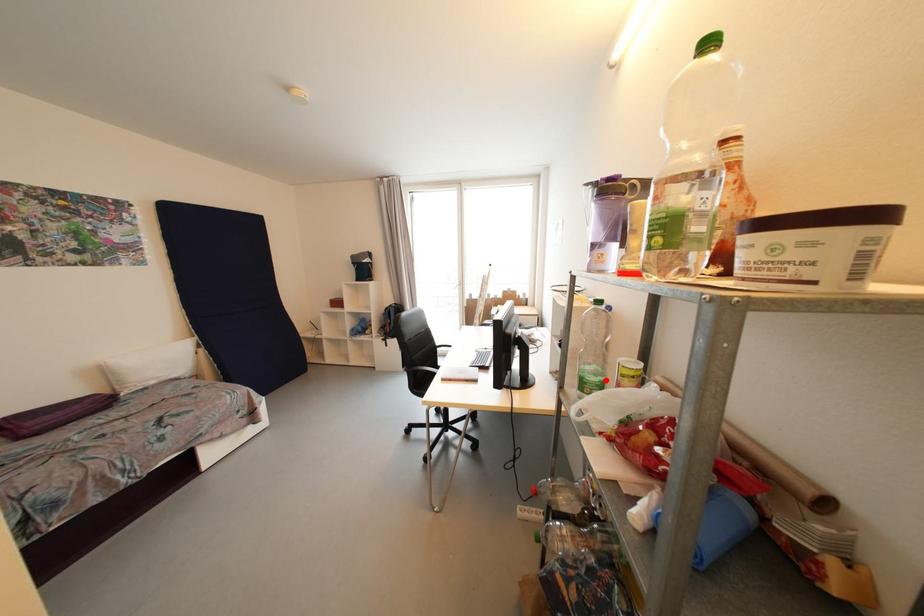
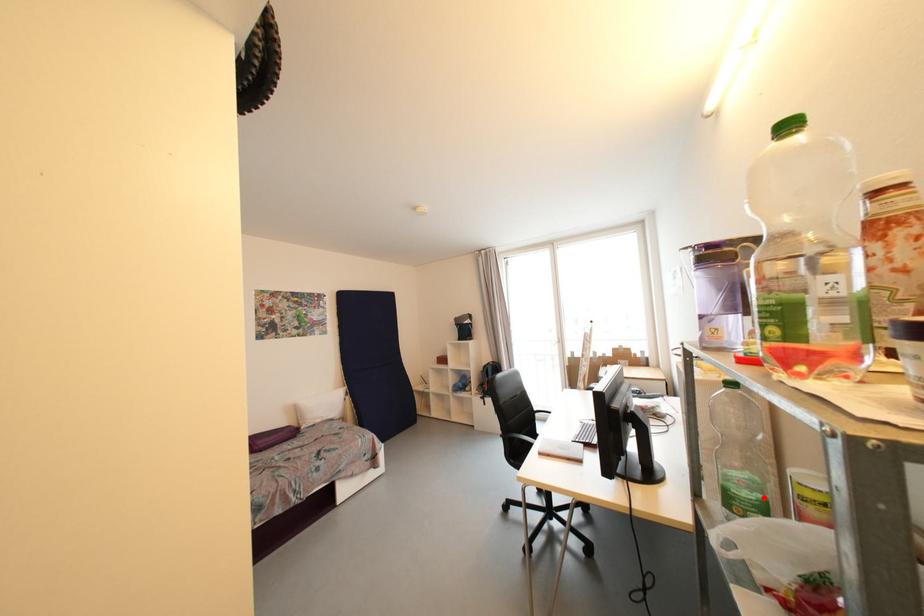
I am providing you with two images of the same scene from different viewpoints. A red point is marked on the first image and another point is marked on the second image. Is the marked point in image1 the same physical position as the marked point in image2?

Yes